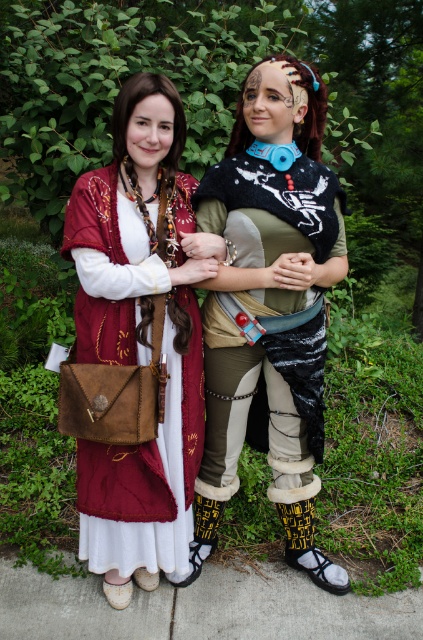
You are trying to determine which purse is on top in the image. Both the matte brown leather purse at center and the suede brown purse at center are visible. Which one is covering part of the other?

The matte brown leather purse at center is positioned over the suede brown purse at center, so it is covering part of the suede brown purse at center.